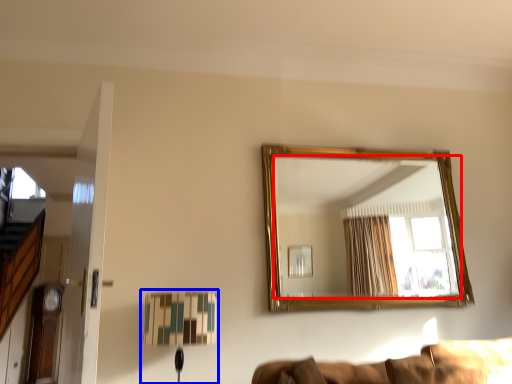
Question: Which point is closer to the camera, mirror (highlighted by a red box) or table lamp (highlighted by a blue box)?

Choices:
 (A) mirror
 (B) table lamp

Answer: (B)